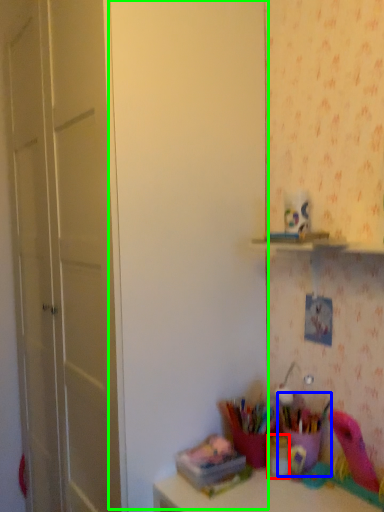
Question: Considering the real-world distances, which object is farthest from stationery (highlighted by a red box)? stationery (highlighted by a blue box) or door (highlighted by a green box)?

Choices:
 (A) stationery
 (B) door

Answer: (B)